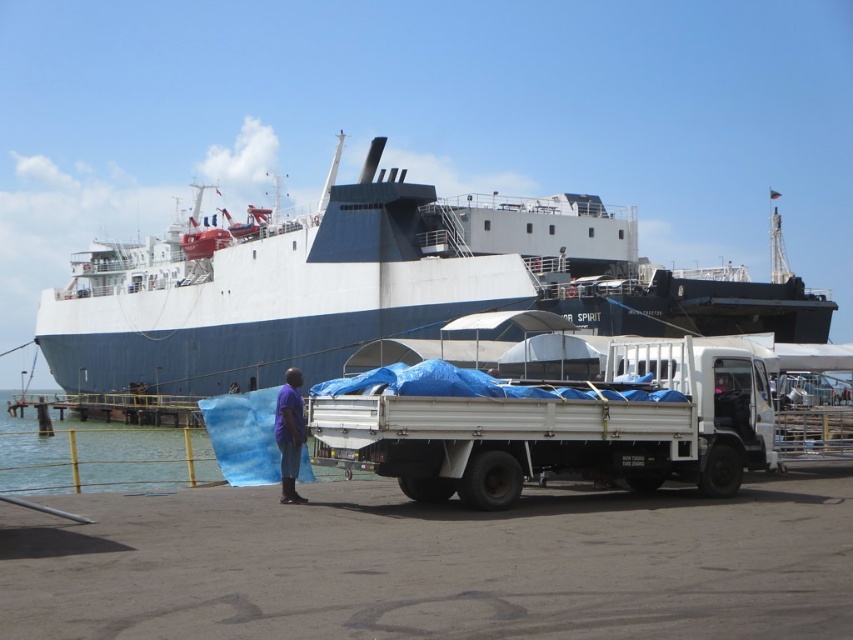
Can you confirm if white matte ship at upper center is wider than purple fabric at center?

Yes.

Which is behind, point (227, 326) or point (297, 404)?

Positioned behind is point (227, 326).

The height and width of the screenshot is (640, 853). I want to click on white matte ship at upper center, so click(379, 285).

Measure the distance between point (587,234) and camera.

Point (587,234) and camera are 82.44 meters apart.

From the picture: Does white matte ship at upper center have a lesser width compared to blue water at lower left?

No.

Image resolution: width=853 pixels, height=640 pixels. In order to click on white matte ship at upper center in this screenshot , I will do tap(379, 285).

Find the location of `white matte ship at upper center`. white matte ship at upper center is located at coordinates (379, 285).

How far apart are blue water at lower left and purple fabric at center?

blue water at lower left is 18.04 meters away from purple fabric at center.

Does point (45, 481) come farther from viewer compared to point (296, 467)?

That is True.

You are a GUI agent. You are given a task and a screenshot of the screen. Output one action in this format:
    pyautogui.click(x=<x>, y=<y>)
    Task: Click on the blue water at lower left
    
    Given the screenshot: What is the action you would take?
    pyautogui.click(x=86, y=454)